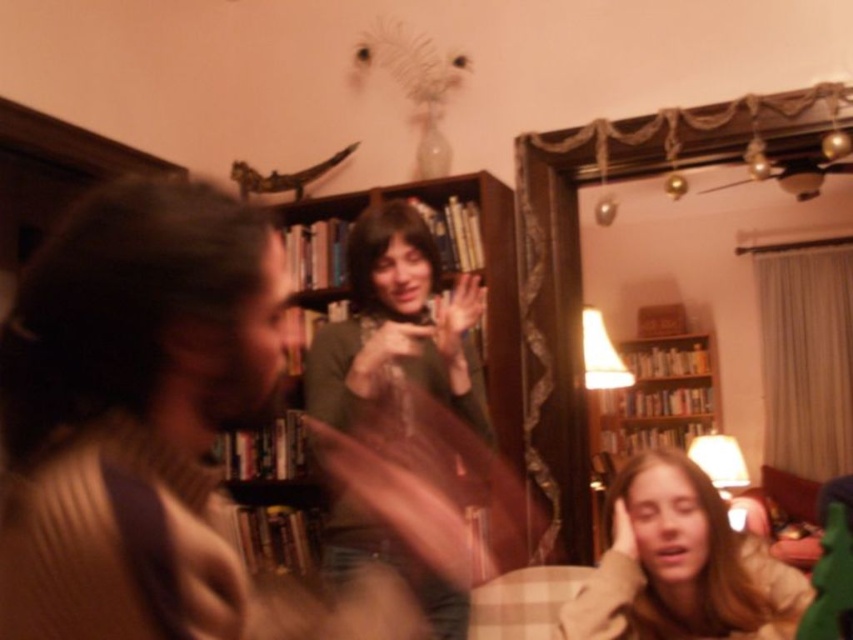
Does rough wool sweater at left have a lesser height compared to matte green sweater at center?

Yes.

Who is more forward, (86, 550) or (344, 513)?

Point (86, 550)

Where is `rough wool sweater at left`? The image size is (853, 640). rough wool sweater at left is located at coordinates (125, 388).

In order to click on rough wool sweater at left in this screenshot , I will do `click(125, 388)`.

In the scene shown: Between blonde hair at lower right and wooden bookshelf at center, which one has less height?

With less height is blonde hair at lower right.

Does point (717, 612) come farther from viewer compared to point (683, 381)?

That is False.

Does point (613, 605) lie behind point (601, 516)?

No, (613, 605) is in front of (601, 516).

Where is `blonde hair at lower right`? blonde hair at lower right is located at coordinates (682, 564).

Does point (369, 237) come closer to viewer compared to point (598, 515)?

Yes, point (369, 237) is in front of point (598, 515).

Between matte green sweater at center and wooden bookshelf at center, which one has less height?

matte green sweater at center

The width and height of the screenshot is (853, 640). What do you see at coordinates (397, 333) in the screenshot?
I see `matte green sweater at center` at bounding box center [397, 333].

I want to click on matte green sweater at center, so click(x=397, y=333).